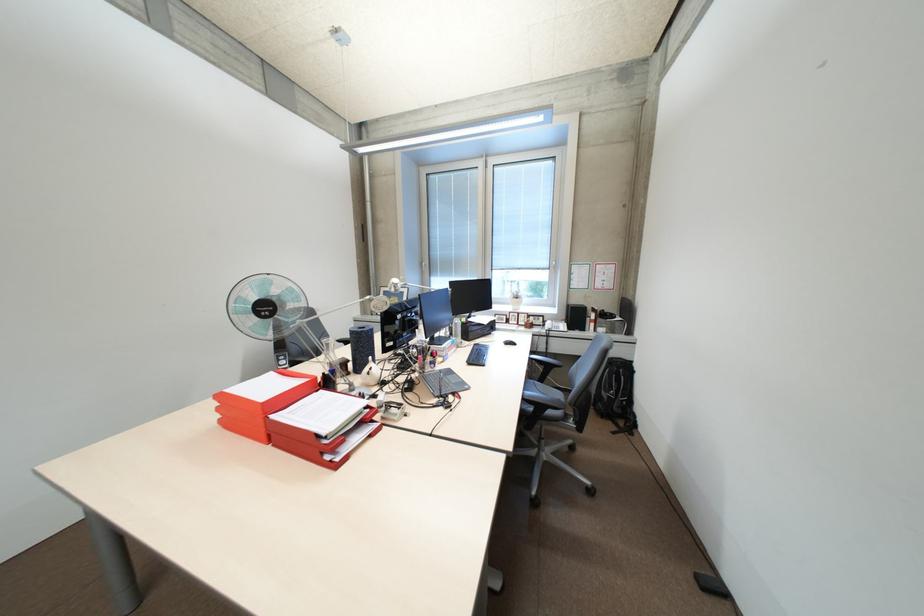
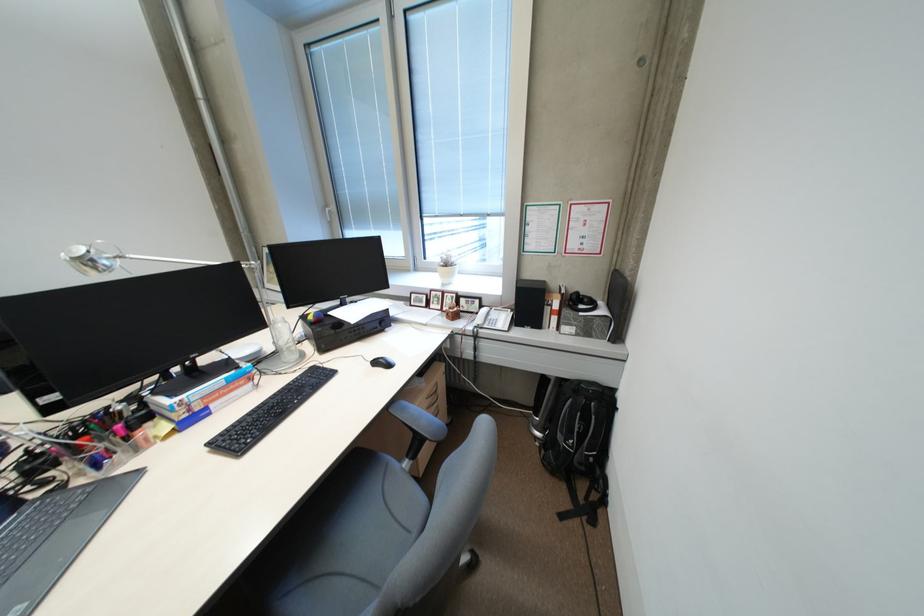
Where in the second image is the point corresponding to pixel 624 427 from the first image?

(576, 501)